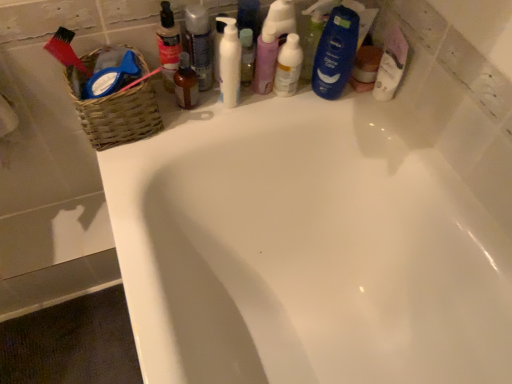
This screenshot has width=512, height=384. I want to click on free space in front of translucent plastic bottle at upper center, positioned as the 3th toiletry in left-to-right order, so click(188, 127).